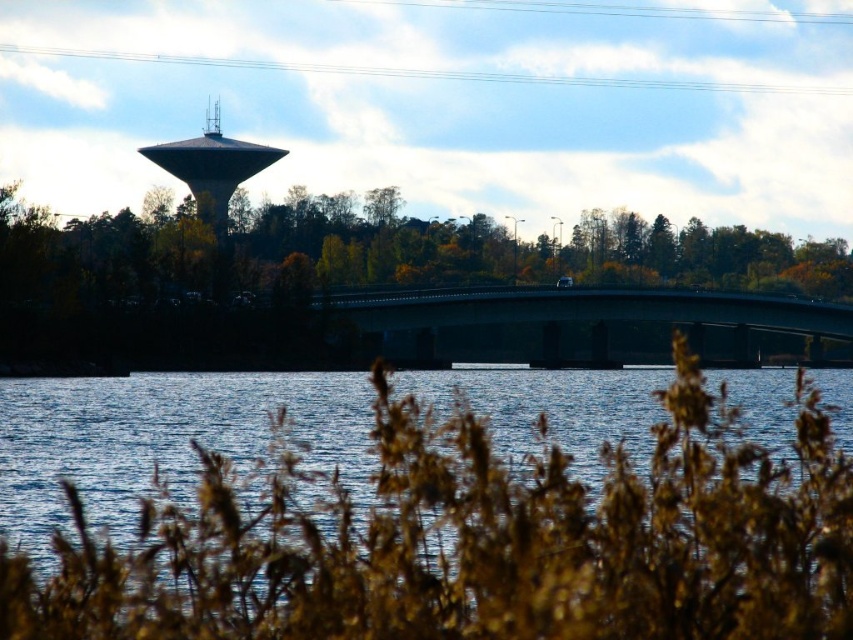
Question: Which object is farther from the camera taking this photo?

Choices:
 (A) green concrete bridge at center
 (B) green leafy trees at center
 (C) matte gray water tower at upper center

Answer: (C)

Question: Among these objects, which one is nearest to the camera?

Choices:
 (A) green concrete bridge at center
 (B) matte gray water tower at upper center

Answer: (A)

Question: Is green concrete bridge at center closer to camera compared to matte gray water tower at upper center?

Choices:
 (A) yes
 (B) no

Answer: (A)

Question: Is green concrete bridge at center thinner than matte gray water tower at upper center?

Choices:
 (A) yes
 (B) no

Answer: (B)

Question: Which is nearer to the green concrete bridge at center?

Choices:
 (A) matte gray water tower at upper center
 (B) green leafy trees at center

Answer: (B)

Question: Does green leafy trees at center have a larger size compared to green concrete bridge at center?

Choices:
 (A) no
 (B) yes

Answer: (B)